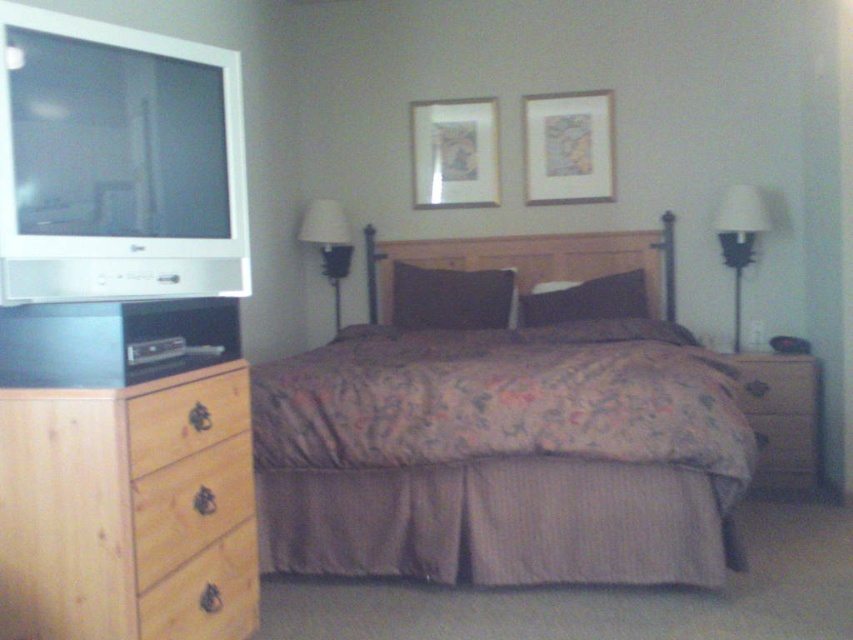
Locate an element on the screen. This screenshot has width=853, height=640. silver metallic television at left is located at coordinates (117, 163).

Find the location of a particular element. silver metallic television at left is located at coordinates (117, 163).

Find the location of a particular element. silver metallic television at left is located at coordinates (117, 163).

Can you confirm if floral fabric bed at center is taller than white fabric lampshade at center?

Indeed, floral fabric bed at center has a greater height compared to white fabric lampshade at center.

Which is more to the left, floral fabric bed at center or white fabric lampshade at center?

white fabric lampshade at center

Does point (283, 472) come behind point (335, 259)?

No, it is not.

This screenshot has width=853, height=640. Identify the location of floral fabric bed at center. [x=503, y=456].

Which is in front, point (437, 445) or point (244, 416)?

Point (244, 416)

Where is `floral-patterned fabric at center`? Image resolution: width=853 pixels, height=640 pixels. floral-patterned fabric at center is located at coordinates (503, 400).

Locate an element on the screen. This screenshot has height=640, width=853. floral-patterned fabric at center is located at coordinates (503, 400).